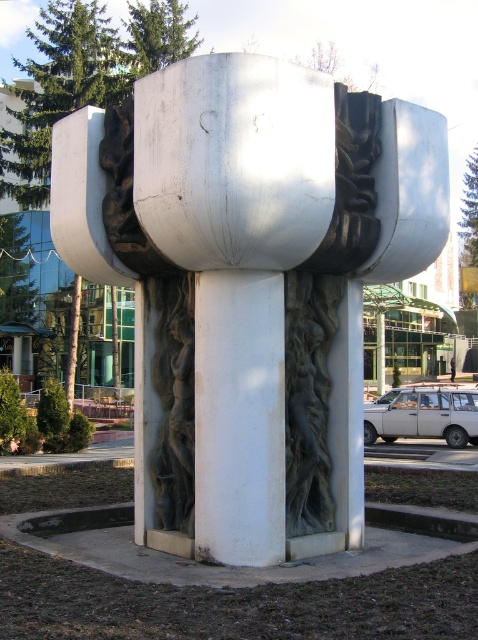
You are an art student analyzing the sculpture. You notice two parts of the sculpture labeled as the white polished stone sculpture at center and the white smooth pillar at center. Which part is taller?

The white polished stone sculpture at center is taller than the white smooth pillar at center.